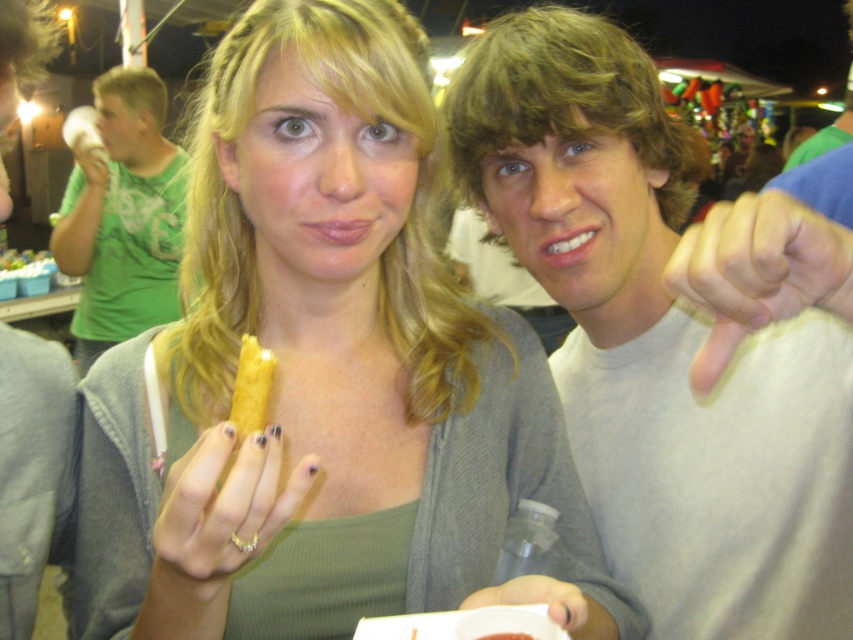
You are standing at the origin point in the image. Which of the two points, point (619,92) or point (701,228), is farther away from you?

Point (619,92) is farther away from you because it is behind point (701,228).

You are designing a new fashion line and need to place a smooth gray sweater at center and a matte skin thumb at lower right in an advertisement. The advertisement requires that the smaller object must be placed in the foreground. Which object should be placed in the foreground?

The matte skin thumb at lower right should be placed in the foreground because it is smaller than the smooth gray sweater at center.